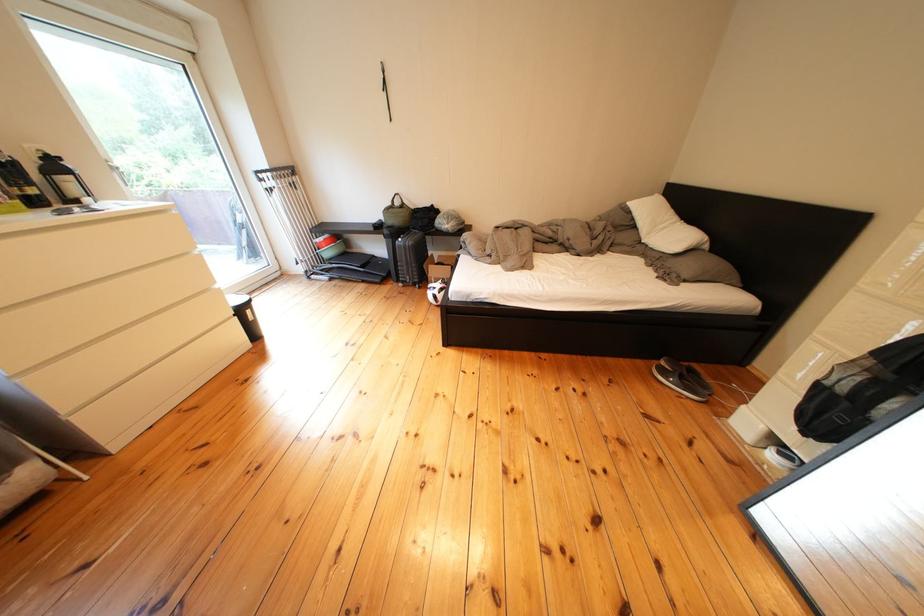
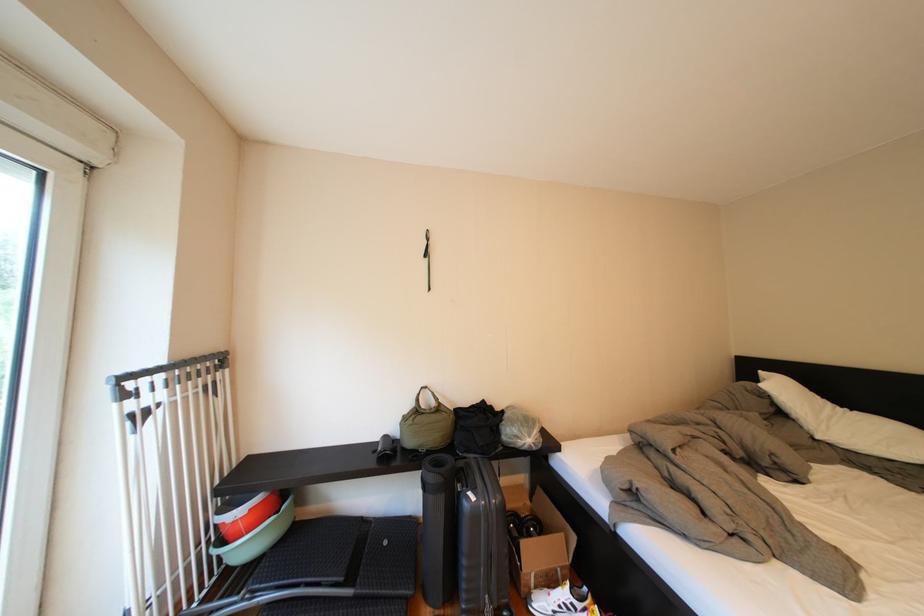
In the second image, find the point that corresponds to (x=407, y=206) in the first image.

(431, 405)